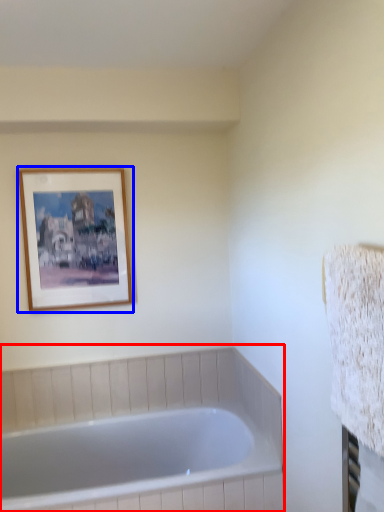
Question: Among these objects, which one is nearest to the camera, bathtub (highlighted by a red box) or picture frame (highlighted by a blue box)?

Choices:
 (A) bathtub
 (B) picture frame

Answer: (A)